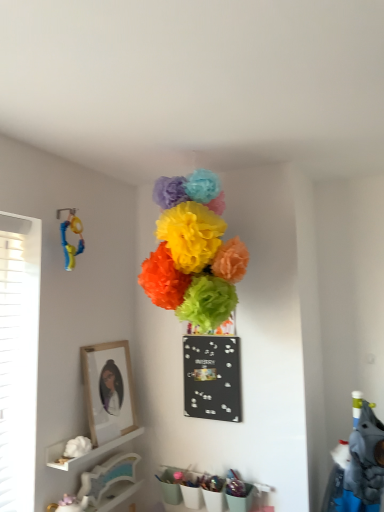
Question: Would you say bright tissue paper flowers at center, which appears as the 3th flower when ordered from the bottom, is outside white glossy shelf at lower left?

Choices:
 (A) no
 (B) yes

Answer: (B)

Question: Considering the relative sizes of bright tissue paper flowers at center, the 2th flower positioned from the right, and white glossy shelf at lower left in the image provided, is bright tissue paper flowers at center, the 2th flower positioned from the right, thinner than white glossy shelf at lower left?

Choices:
 (A) no
 (B) yes

Answer: (A)

Question: Considering the relative sizes of bright tissue paper flowers at center, which appears as the 3th flower when ordered from the bottom, and white glossy shelf at lower left in the image provided, is bright tissue paper flowers at center, which appears as the 3th flower when ordered from the bottom, taller than white glossy shelf at lower left?

Choices:
 (A) yes
 (B) no

Answer: (A)

Question: Considering the relative positions of bright tissue paper flowers at center, which is the second flower in left-to-right order, and white glossy shelf at lower left in the image provided, is bright tissue paper flowers at center, which is the second flower in left-to-right order, to the left of white glossy shelf at lower left from the viewer's perspective?

Choices:
 (A) no
 (B) yes

Answer: (A)

Question: Considering the relative positions of bright tissue paper flowers at center, which appears as the 3th flower when ordered from the bottom, and white glossy shelf at lower left in the image provided, is bright tissue paper flowers at center, which appears as the 3th flower when ordered from the bottom, behind white glossy shelf at lower left?

Choices:
 (A) yes
 (B) no

Answer: (B)

Question: From the image's perspective, is black matte bulletin board at center above or below white matte flower at lower left, the third flower when ordered from top to bottom?

Choices:
 (A) above
 (B) below

Answer: (A)

Question: Do you think black matte bulletin board at center is within white matte flower at lower left, the 1th flower when ordered from bottom to top, or outside of it?

Choices:
 (A) outside
 (B) inside

Answer: (A)

Question: Looking at the image, does black matte bulletin board at center seem bigger or smaller compared to white matte flower at lower left, the third flower when ordered from top to bottom?

Choices:
 (A) big
 (B) small

Answer: (A)

Question: From a real-world perspective, is black matte bulletin board at center physically located above or below white matte flower at lower left, which appears as the 3th flower when viewed from the right?

Choices:
 (A) below
 (B) above

Answer: (B)

Question: Considering the positions of rubberized yellow and blue toy at left and white matte shelf at lower left in the image, is rubberized yellow and blue toy at left wider or thinner than white matte shelf at lower left?

Choices:
 (A) thin
 (B) wide

Answer: (A)

Question: Based on their sizes in the image, would you say rubberized yellow and blue toy at left is bigger or smaller than white matte shelf at lower left?

Choices:
 (A) small
 (B) big

Answer: (B)

Question: Is rubberized yellow and blue toy at left taller or shorter than white matte shelf at lower left?

Choices:
 (A) tall
 (B) short

Answer: (A)

Question: Is point (72, 259) closer or farther from the camera than point (92, 450)?

Choices:
 (A) closer
 (B) farther

Answer: (B)

Question: In terms of width, does white matte flower at lower left, the third flower when ordered from top to bottom, look wider or thinner when compared to bright tissue paper flowers at center, the 2th flower positioned from the right?

Choices:
 (A) wide
 (B) thin

Answer: (B)

Question: Based on their sizes in the image, would you say white matte flower at lower left, which appears as the 3th flower when viewed from the right, is bigger or smaller than bright tissue paper flowers at center, the 2th flower positioned from the right?

Choices:
 (A) big
 (B) small

Answer: (B)